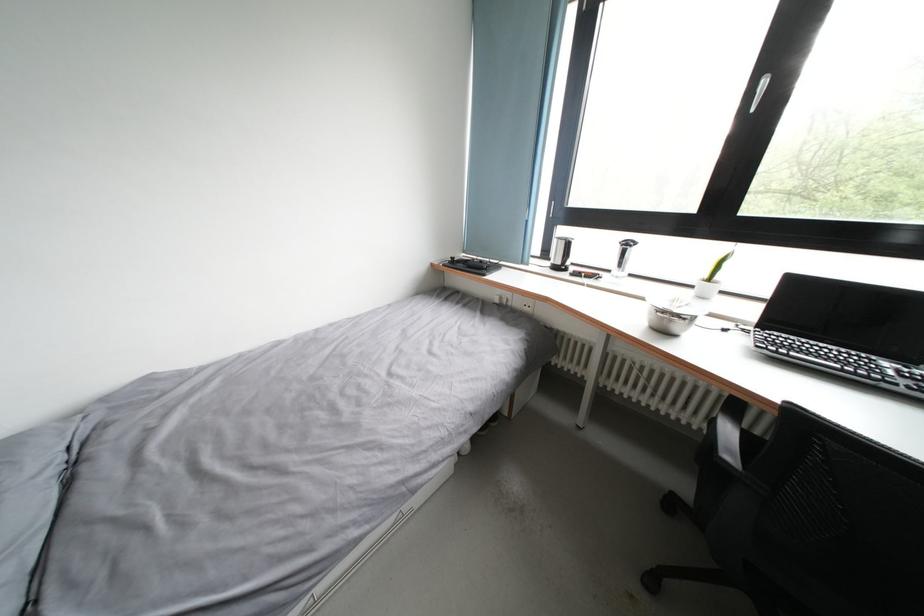
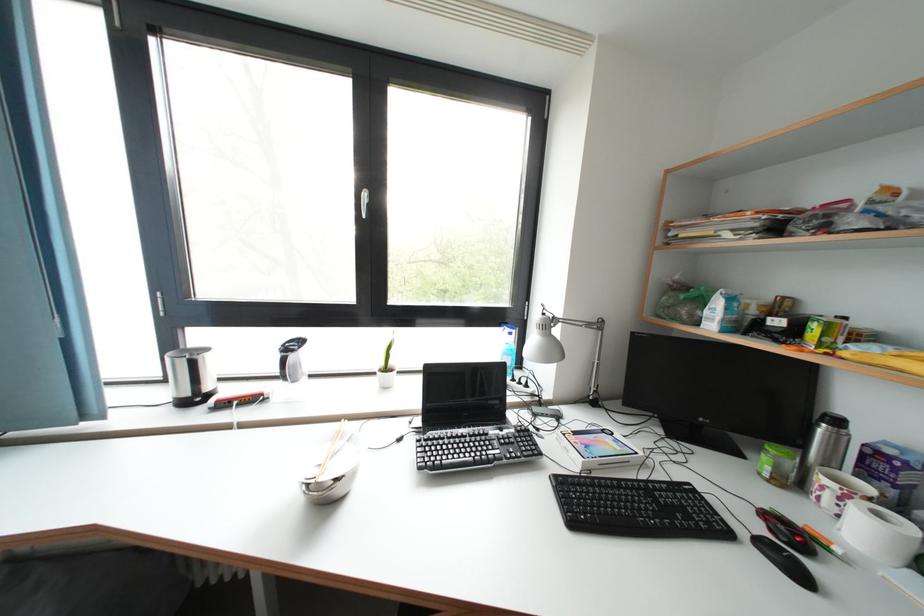
Where in the second image is the point corresponding to (x=624, y=254) from the first image?

(285, 362)